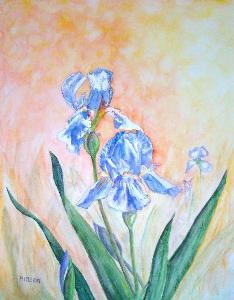
At what (x,y) coordinates should I click in order to perform the action: click on art. Please return your answer as a coordinate pair (x, y). The image size is (234, 300). Looking at the image, I should click on (213, 70).